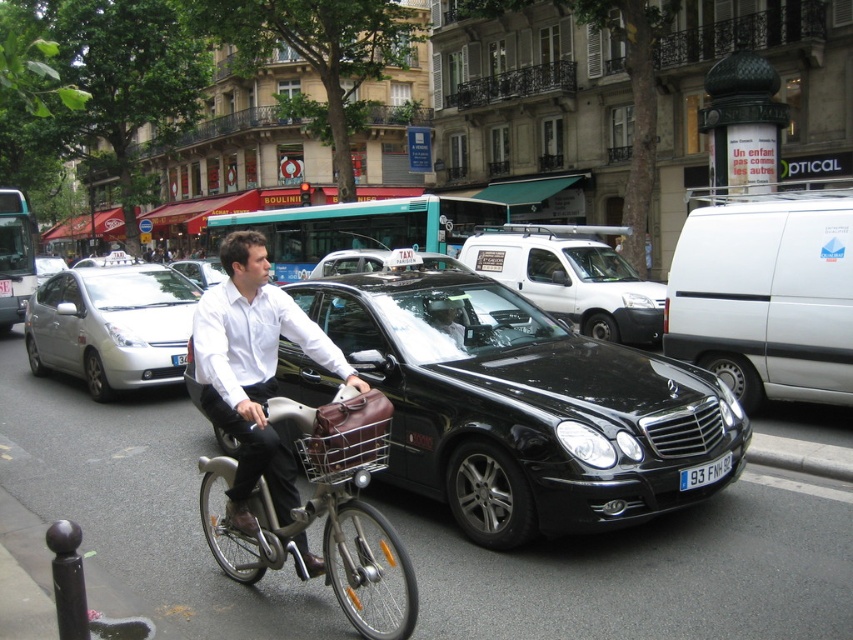
Question: Is silver metallic hatchback at left bigger than silver metallic sedan at center?

Choices:
 (A) yes
 (B) no

Answer: (B)

Question: Can you confirm if black glossy sedan at center is bigger than matte white shirt at center?

Choices:
 (A) yes
 (B) no

Answer: (A)

Question: Considering the real-world distances, which object is farthest from the silver metallic hatchback at left?

Choices:
 (A) metallic silver basket at center
 (B) white plastic license plate at center

Answer: (B)

Question: Among these points, which one is farthest from the camera?

Choices:
 (A) (198, 266)
 (B) (646, 307)
 (C) (694, 480)

Answer: (A)

Question: Estimate the real-world distances between objects in this image. Which object is farther from the silver metallic bicycle at center?

Choices:
 (A) silver metallic sedan at center
 (B) matte white shirt at center
 (C) black glossy sedan at center
 (D) silver metallic hatchback at left

Answer: (A)

Question: Does silver metallic hatchback at left appear under white plastic license plate at center?

Choices:
 (A) no
 (B) yes

Answer: (A)